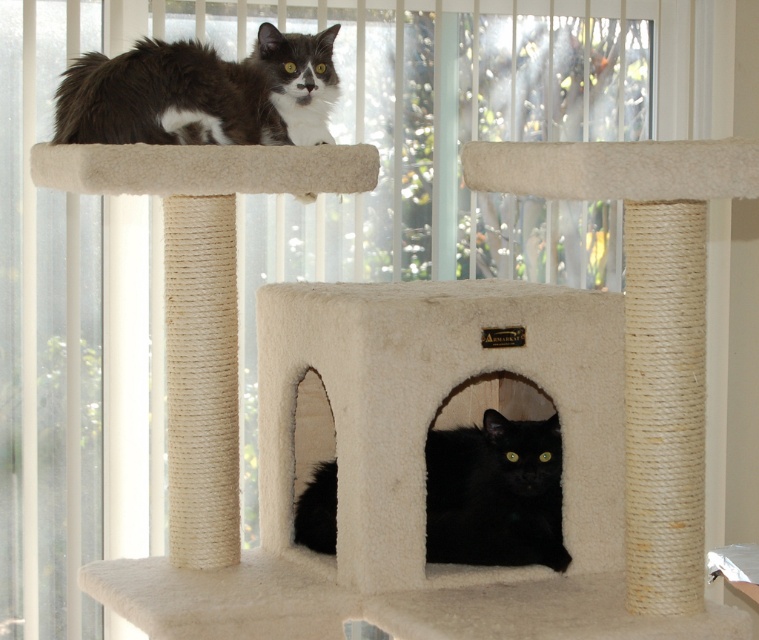
Does point (117, 77) come closer to viewer compared to point (430, 484)?

Yes, point (117, 77) is closer to viewer.

The height and width of the screenshot is (640, 759). I want to click on gray and white fur cat at upper left, so click(200, 93).